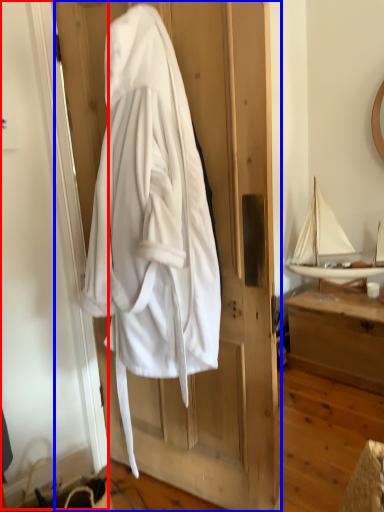
Question: Which object is further to the camera taking this photo, screen door (highlighted by a red box) or door (highlighted by a blue box)?

Choices:
 (A) screen door
 (B) door

Answer: (B)